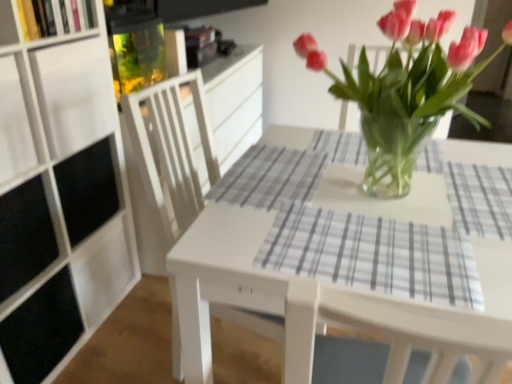
This screenshot has width=512, height=384. What are the coordinates of `free spot behind gray plaid placemat at center` in the screenshot? It's located at (382, 198).